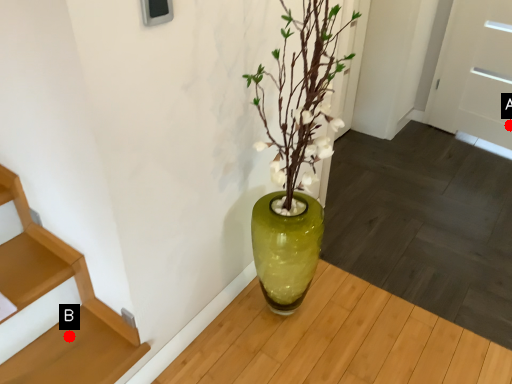
Question: Two points are circled on the image, labeled by A and B beside each circle. Which point is closer to the camera?

Choices:
 (A) A is closer
 (B) B is closer

Answer: (B)